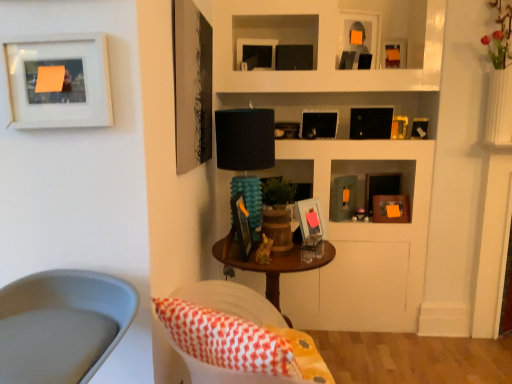
Question: Is matte black picture frame at upper center, acting as the 8th picture frame starting from the back, bigger or smaller than matte black picture frame at center, which is the 2th picture frame from front to back?

Choices:
 (A) small
 (B) big

Answer: (B)

Question: Is matte black picture frame at upper center, acting as the 8th picture frame starting from the back, taller or shorter than matte black picture frame at center, which is the 2th picture frame from front to back?

Choices:
 (A) tall
 (B) short

Answer: (B)

Question: Considering the real-world distances, which object is farthest from the metallic gold picture frame at upper right, arranged as the eighth picture frame when viewed from the front?

Choices:
 (A) black matte picture frame at upper center, placed as the 5th picture frame when sorted from back to front
 (B) matte black picture frame at upper center, the second picture frame from the back
 (C) matte black picture frame at upper center, acting as the 3th picture frame starting from the front
 (D) teal textured lamp at center
 (E) orange matte picture frame at upper right, acting as the ninth picture frame starting from the front

Answer: (D)

Question: Which object is the farthest from the matte black picture frame at center, which is the 2th picture frame from front to back?

Choices:
 (A) matte black picture frame at upper right, which ranks as the 5th picture frame in front-to-back order
 (B) matte black picture frame at upper center, acting as the 3th picture frame starting from the front
 (C) white fabric chair at lower left
 (D) orange matte picture frame at upper right, acting as the ninth picture frame starting from the front
 (E) metallic gold picture frame at upper right, the 4th picture frame viewed from the back

Answer: (A)